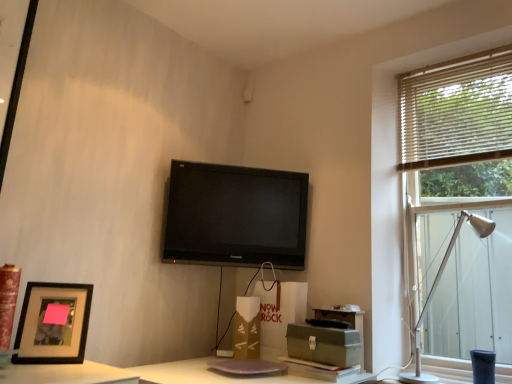
Question: In the image, is matte black picture frame at lower left positioned in front of or behind matte white speaker at upper center?

Choices:
 (A) behind
 (B) front

Answer: (B)

Question: Is matte black picture frame at lower left taller or shorter than matte white speaker at upper center?

Choices:
 (A) short
 (B) tall

Answer: (B)

Question: Which object is the farthest from the green cardboard box at lower center, which ranks as the 2th cardboard box in back-to-front order?

Choices:
 (A) black glossy tv at upper center
 (B) wooden blinds at right
 (C) matte black picture frame at lower left
 (D) silver metallic table lamp at right
 (E) matte white speaker at upper center

Answer: (E)

Question: Considering the real-world distances, which object is closest to the matte brown cardboard box at center, the 1th cardboard box viewed from the back?

Choices:
 (A) silver metallic table lamp at right
 (B) white wooden blinds at upper right
 (C) matte black picture frame at lower left
 (D) black glossy tv at upper center
 (E) matte white speaker at upper center

Answer: (D)